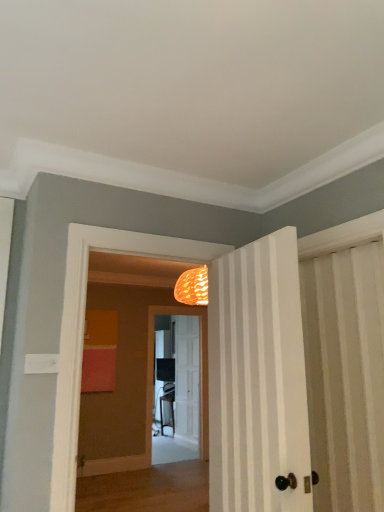
Question: From the image's perspective, does white striped door at center, which is the first door in right-to-left order, appear lower than matte black screen door at center?

Choices:
 (A) no
 (B) yes

Answer: (A)

Question: Is white striped door at center, which appears as the first door when viewed from the front, behind matte black screen door at center?

Choices:
 (A) no
 (B) yes

Answer: (A)

Question: Is white striped door at center, the 2th door positioned from the bottom, shorter than matte black screen door at center?

Choices:
 (A) yes
 (B) no

Answer: (A)

Question: Are white striped door at center, the 2th door positioned from the bottom, and matte black screen door at center located far from each other?

Choices:
 (A) no
 (B) yes

Answer: (B)

Question: Does white striped door at center, the 2th door positioned from the bottom, have a greater width compared to matte black screen door at center?

Choices:
 (A) no
 (B) yes

Answer: (B)

Question: Can you confirm if white striped door at center, the second door viewed from the left, is positioned to the right of matte black screen door at center?

Choices:
 (A) yes
 (B) no

Answer: (A)

Question: From the image's perspective, does white wooden door at center, which is the second door from right to left, appear lower than white striped door at center, which appears as the first door when viewed from the front?

Choices:
 (A) yes
 (B) no

Answer: (A)

Question: From a real-world perspective, is white wooden door at center, the second door when ordered from front to back, positioned over white striped door at center, which appears as the first door when viewed from the front, based on gravity?

Choices:
 (A) no
 (B) yes

Answer: (A)

Question: From the image's perspective, is white wooden door at center, acting as the first door starting from the back, on top of white striped door at center, the 2th door positioned from the bottom?

Choices:
 (A) no
 (B) yes

Answer: (A)

Question: Are white wooden door at center, the second door when ordered from front to back, and white striped door at center, which ranks as the first door in top-to-bottom order, making contact?

Choices:
 (A) yes
 (B) no

Answer: (B)

Question: Does white wooden door at center, marked as the 2th door in a top-to-bottom arrangement, have a lesser width compared to white striped door at center, which appears as the first door when viewed from the front?

Choices:
 (A) yes
 (B) no

Answer: (A)

Question: Is the position of white wooden door at center, the second door when ordered from front to back, more distant than that of white striped door at center, the second door viewed from the left?

Choices:
 (A) no
 (B) yes

Answer: (B)

Question: Is white striped door at center, which is the first door in right-to-left order, oriented towards white wooden door at center, the 1th door positioned from the bottom?

Choices:
 (A) yes
 (B) no

Answer: (B)